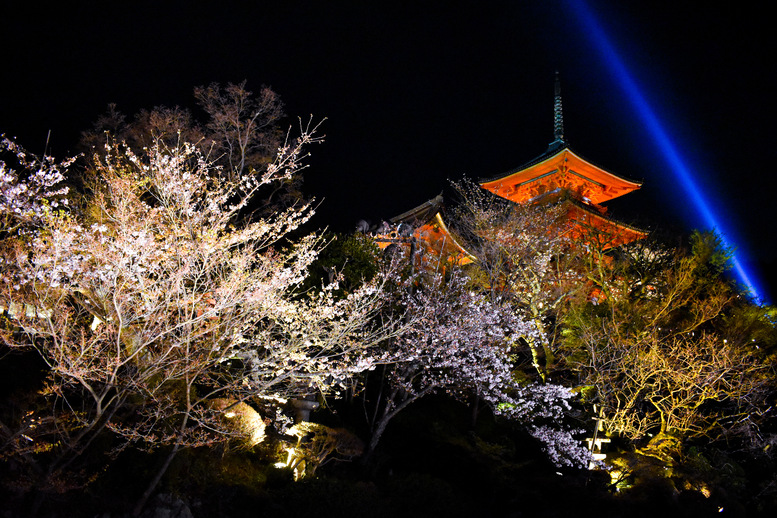
Locate an element on the screen. The image size is (777, 518). light source is located at coordinates (290, 455).